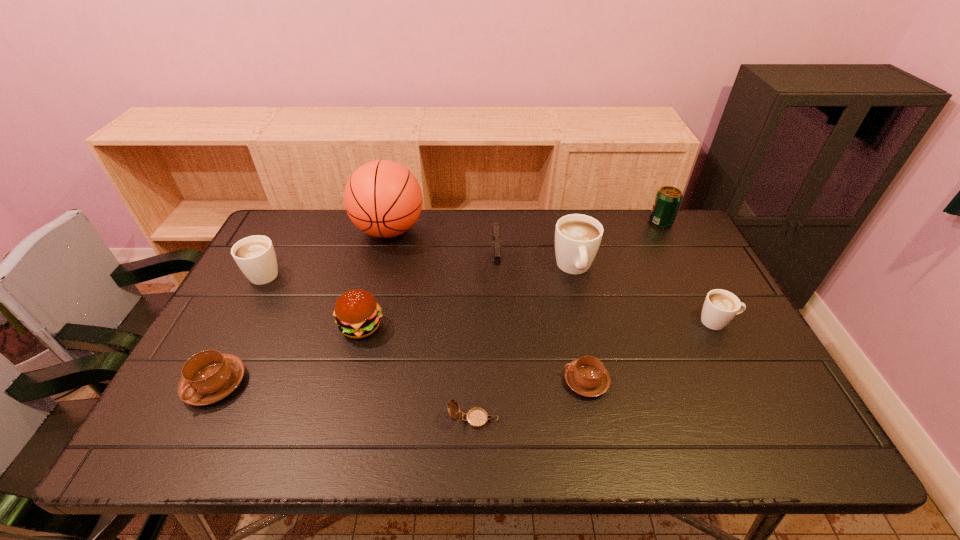
Image resolution: width=960 pixels, height=540 pixels. Find the location of `the third farthest cappuccino`. the third farthest cappuccino is located at coordinates (720, 306).

Find the location of a particular element. This screenshot has width=960, height=540. the bigger brown cappuccino is located at coordinates (209, 376).

Identify the location of compass. The height and width of the screenshot is (540, 960). (477, 418).

At what (x,y) coordinates should I click in order to perform the action: click on the smaller brown cappuccino. Please return your answer as a coordinate pair (x, y). This screenshot has height=540, width=960. Looking at the image, I should click on (587, 376).

Locate an element on the screen. This screenshot has height=540, width=960. the right brown cappuccino is located at coordinates (587, 376).

Find the location of a particular element. vacant region located 0.110m on the left of the tallest object is located at coordinates (321, 230).

At what (x,y) coordinates should I click in order to perform the action: click on vacant region located with the handle on the side of the second white cappuccino from right to left. Please return your answer as a coordinate pair (x, y). Looking at the image, I should click on (584, 308).

You are a GUI agent. You are given a task and a screenshot of the screen. Output one action in this format:
    pyautogui.click(x=<x>, y=<y>)
    Task: Click on the vacant space located 0.140m on the front of the green beer can
    The image size is (960, 540).
    Given the screenshot: What is the action you would take?
    pyautogui.click(x=678, y=256)

Identify the location of vacant space located 0.050m aim along the barrel of the pistol. This screenshot has height=540, width=960. coord(497,299).

Locate an element on the screen. The height and width of the screenshot is (540, 960). free space located with the handle on the side of the leftmost white cappuccino is located at coordinates (287, 232).